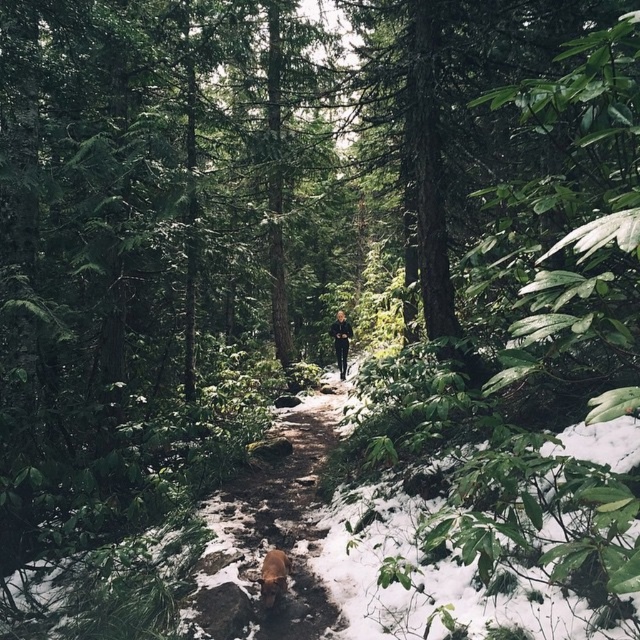
Does point (260, 529) lie behind point (339, 332)?

No, it is in front of (339, 332).

Can you confirm if snowy dirt path at center is shorter than black matte pants at center?

Yes, snowy dirt path at center is shorter than black matte pants at center.

Is point (225, 563) less distant than point (339, 369)?

Yes, it is.

Locate an element on the screen. This screenshot has width=640, height=640. snowy dirt path at center is located at coordinates (269, 532).

Between snowy dirt path at center and brown fur dog at center, which one has less height?

With less height is snowy dirt path at center.

Who is more forward, (x=236, y=486) or (x=269, y=564)?

Point (x=269, y=564) is more forward.

Measure the distance between point (x=289, y=596) and camera.

4.71 meters

You are a GUI agent. You are given a task and a screenshot of the screen. Output one action in this format:
    pyautogui.click(x=<x>, y=<y>)
    Task: Click on the snowy dirt path at center
    The image size is (640, 640).
    Given the screenshot: What is the action you would take?
    pyautogui.click(x=269, y=532)

Is brown fur dog at center positioned behind black matte pants at center?

No, it is not.

Is brown fur dog at center shorter than black matte pants at center?

Yes.

Between point (275, 579) and point (332, 330), which one is positioned behind?

The point (332, 330) is behind.

Locate an element on the screen. This screenshot has width=640, height=640. brown fur dog at center is located at coordinates (273, 577).